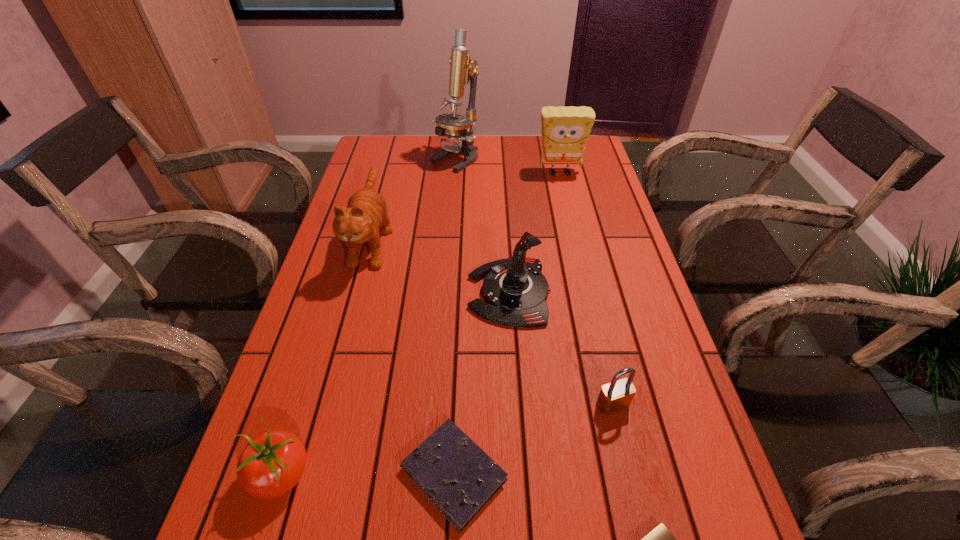
The width and height of the screenshot is (960, 540). Identify the location of free space between the joystick and the diary. (481, 383).

Image resolution: width=960 pixels, height=540 pixels. What are the coordinates of `empty location between the microscope and the joystick` in the screenshot? It's located at point(482,226).

Locate an element on the screen. unoccupied area between the diary and the joystick is located at coordinates (481, 383).

Where is `blank region between the cat and the sponge`? blank region between the cat and the sponge is located at coordinates (466, 206).

Where is `object that ranks as the fourth closest to the fifth tallest object`? object that ranks as the fourth closest to the fifth tallest object is located at coordinates (272, 463).

This screenshot has width=960, height=540. In order to click on object that is the third nearest to the shortest object in this screenshot , I will do `click(515, 290)`.

You are a GUI agent. You are given a task and a screenshot of the screen. Output one action in this format:
    pyautogui.click(x=<x>, y=<y>)
    Task: Click on the free space that satisfies the following two spatial constraints: 1. on the face of the sponge; 2. on the handle side of the joystick
    Image resolution: width=960 pixels, height=540 pixels.
    Given the screenshot: What is the action you would take?
    pyautogui.click(x=588, y=293)

I want to click on free spot that satisfies the following two spatial constraints: 1. on the face of the sponge; 2. on the handle side of the joystick, so click(x=588, y=293).